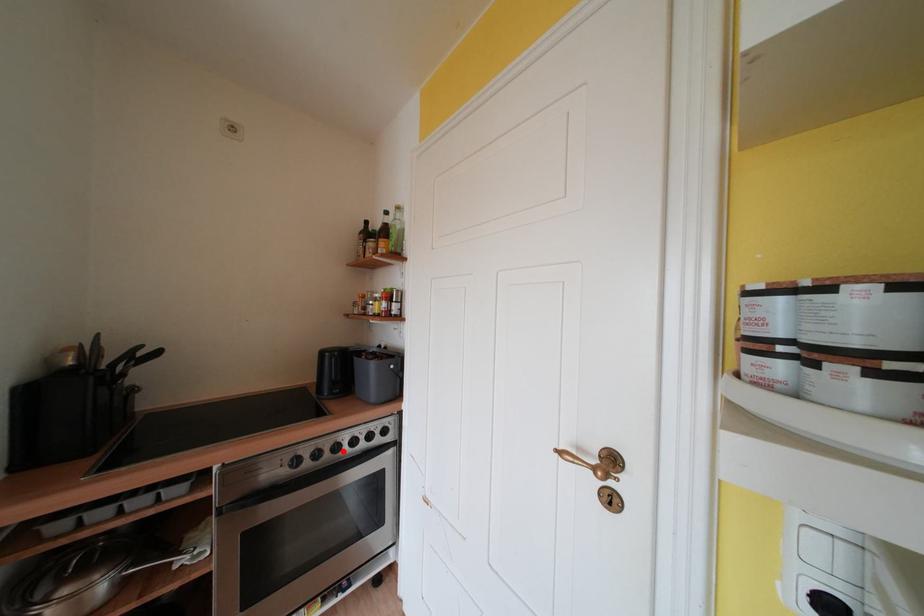
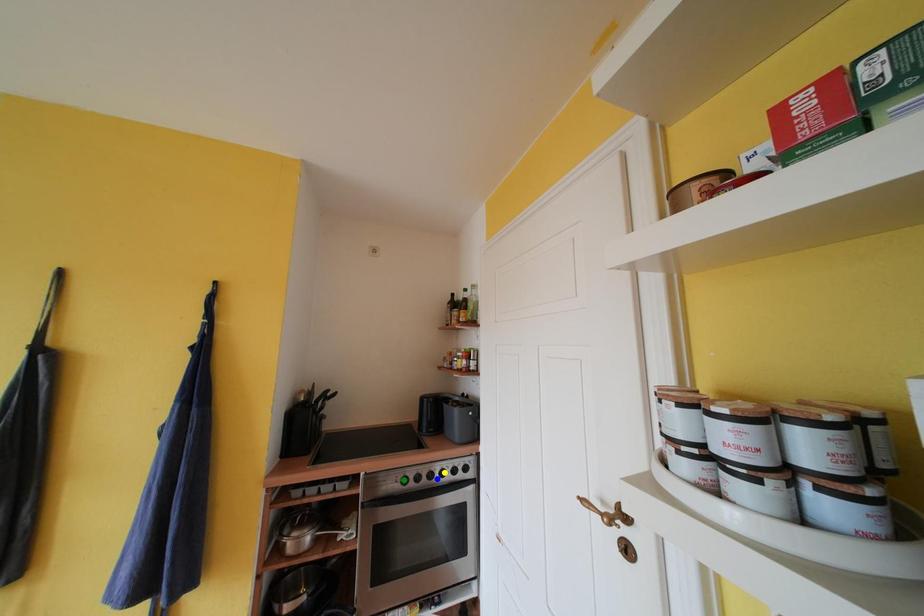
Question: I am providing you with two images of the same scene from different viewpoints. A red point is marked on the first image. You are given multiple points on the second image. Which point in image 2 is actually the same real-world point as the red point in image 1?

Choices:
 (A) blue point
 (B) green point
 (C) yellow point

Answer: (A)